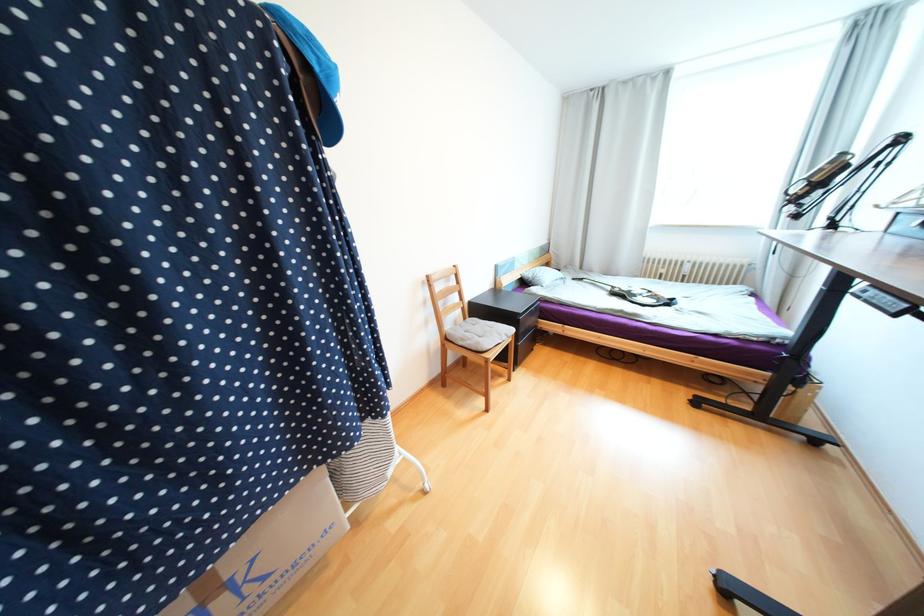
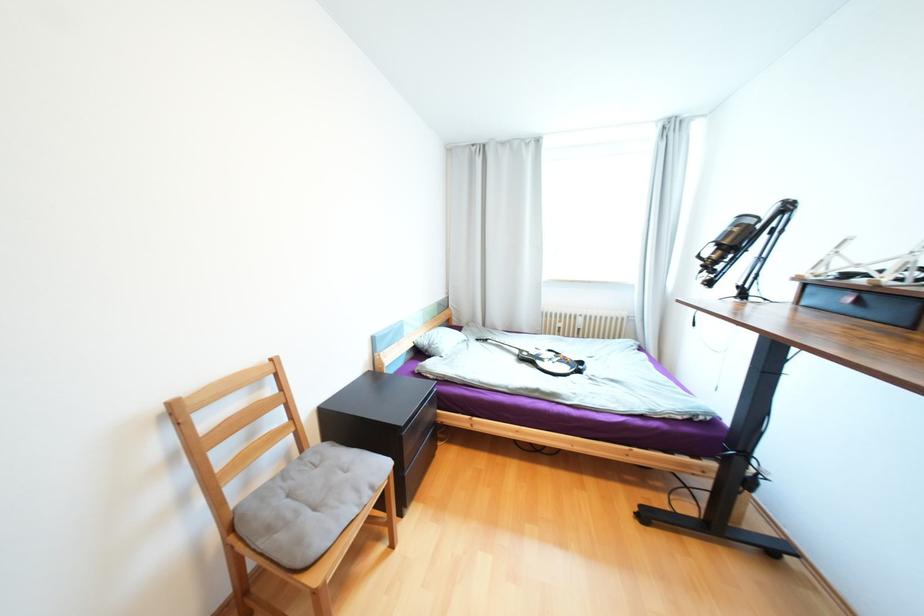
Question: The images are taken continuously from a first-person perspective. In which direction is your viewpoint rotating?

Choices:
 (A) Left
 (B) Right
 (C) Up
 (D) Down

Answer: (B)